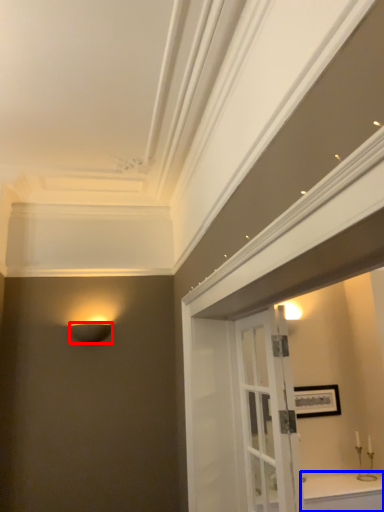
Question: Which of the following is the closest to the observer, lamp (highlighted by a red box) or cabinetry (highlighted by a blue box)?

Choices:
 (A) lamp
 (B) cabinetry

Answer: (B)